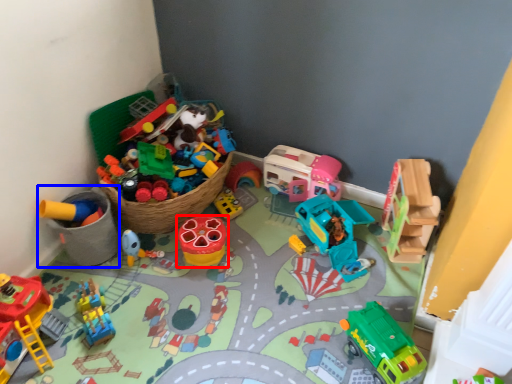
Question: Among these objects, which one is nearest to the camera, toy (highlighted by a red box) or toy (highlighted by a blue box)?

Choices:
 (A) toy
 (B) toy

Answer: (B)